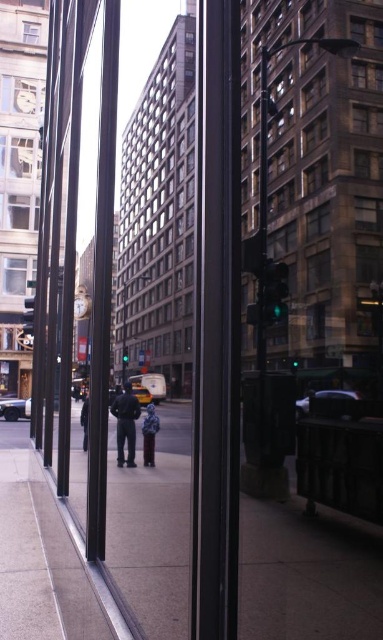
You are a delivery person trying to navigate through the city. You see the smooth concrete sidewalk at center and the blue denim jacket at center. Which one is bigger in size?

The smooth concrete sidewalk at center is larger in size than the blue denim jacket at center.

You are a photographer trying to capture a clear shot of the dark blue jeans at center and the dark blue jacket at center through the reflective glass panels. Which object should you focus on first to ensure both are in focus, considering their sizes?

The dark blue jeans at center is taller than the dark blue jacket at center, so you should focus on the dark blue jeans at center first since it is larger and will require more precise focus to ensure both are in focus.